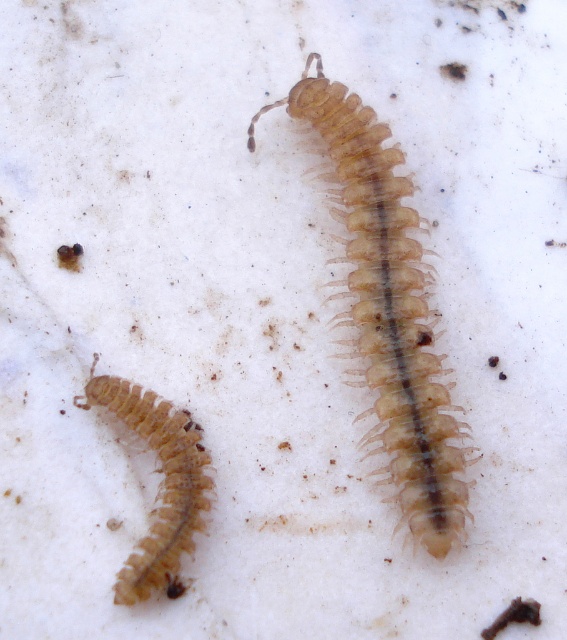
Question: Which object is farther from the camera taking this photo?

Choices:
 (A) translucent beige centipede at center
 (B) translucent beige centipede at lower left

Answer: (A)

Question: Can you confirm if translucent beige centipede at center is smaller than translucent beige centipede at lower left?

Choices:
 (A) no
 (B) yes

Answer: (A)

Question: Which point is farther to the camera?

Choices:
 (A) translucent beige centipede at center
 (B) translucent beige centipede at lower left

Answer: (A)

Question: Is translucent beige centipede at center thinner than translucent beige centipede at lower left?

Choices:
 (A) no
 (B) yes

Answer: (A)

Question: From the image, what is the correct spatial relationship of translucent beige centipede at center in relation to translucent beige centipede at lower left?

Choices:
 (A) below
 (B) above

Answer: (B)